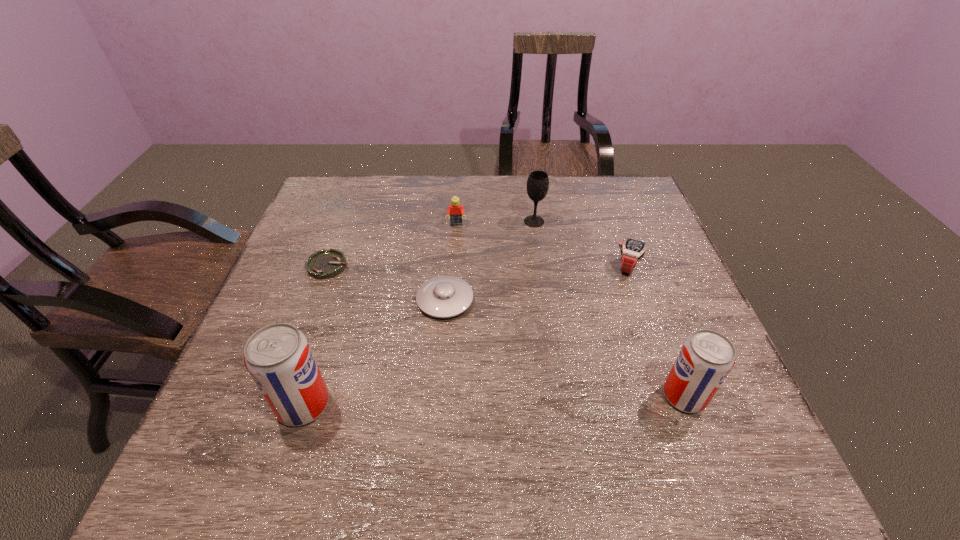
Where is `the fourth closest object relative to the wineglass`? Image resolution: width=960 pixels, height=540 pixels. the fourth closest object relative to the wineglass is located at coordinates (323, 264).

Choose which object is the second nearest neighbor to the wineglass. Please provide its 2D coordinates. Your answer should be formatted as a tuple, i.e. [(x, y)], where the tuple contains the x and y coordinates of a point satisfying the conditions above.

[(632, 251)]

Identify the location of vacant point that satisfies the following two spatial constraints: 1. on the front side of the sixth tallest object; 2. on the right side of the right soda. (438, 396).

Where is `free space that satisfies the following two spatial constraints: 1. on the front side of the third object from right to left; 2. on the right side of the shorter soda`? This screenshot has height=540, width=960. free space that satisfies the following two spatial constraints: 1. on the front side of the third object from right to left; 2. on the right side of the shorter soda is located at coordinates (560, 396).

This screenshot has width=960, height=540. Identify the location of free spot that satisfies the following two spatial constraints: 1. on the face of the Lego; 2. on the left side of the shorter soda. (445, 396).

At what (x,y) coordinates should I click in order to perform the action: click on vacant space that satisfies the following two spatial constraints: 1. on the back side of the ashtray; 2. on the right side of the wineglass. Please return your answer as a coordinate pair (x, y). Image resolution: width=960 pixels, height=540 pixels. Looking at the image, I should click on (345, 221).

Identify the location of vacant space that satisfies the following two spatial constraints: 1. on the back side of the right soda; 2. on the left side of the tallest object. The width and height of the screenshot is (960, 540). (306, 396).